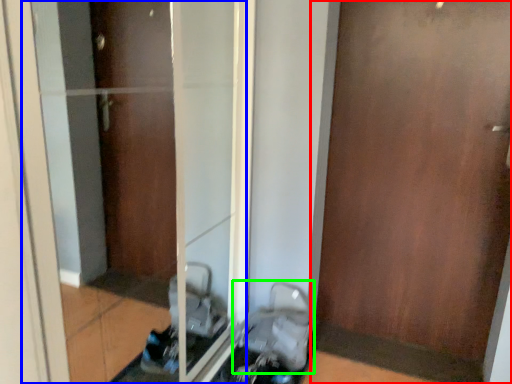
Question: Which object is the farthest from door (highlighted by a red box)? Choose among these: glass door (highlighted by a blue box) or baby carriage (highlighted by a green box).

Choices:
 (A) glass door
 (B) baby carriage

Answer: (A)